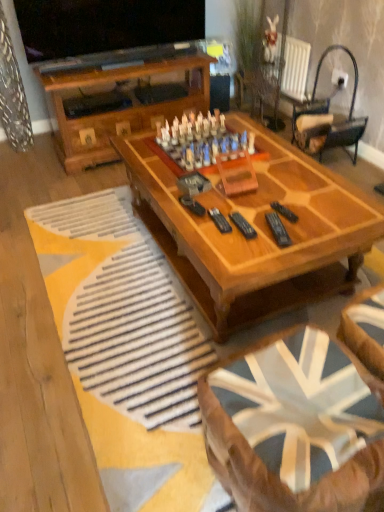
Question: From a real-world perspective, is black plastic remote at center, arranged as the second remote when viewed from the right, on top of wooden chess set at center?

Choices:
 (A) yes
 (B) no

Answer: (A)

Question: Is black plastic remote at center, arranged as the second remote when viewed from the right, at the right side of wooden chess set at center?

Choices:
 (A) no
 (B) yes

Answer: (B)

Question: Does black plastic remote at center, arranged as the second remote when viewed from the right, have a lesser height compared to wooden chess set at center?

Choices:
 (A) yes
 (B) no

Answer: (B)

Question: Are black plastic remote at center, arranged as the second remote when viewed from the right, and wooden chess set at center located far from each other?

Choices:
 (A) no
 (B) yes

Answer: (A)

Question: Would you say black plastic remote at center, arranged as the second remote when viewed from the right, is outside wooden chess set at center?

Choices:
 (A) no
 (B) yes

Answer: (B)

Question: Would you say wooden coffee table at center, the 1th coffee table from the top, is inside or outside black plastic remote at center, arranged as the second remote when viewed from the right?

Choices:
 (A) inside
 (B) outside

Answer: (B)

Question: From their relative heights in the image, would you say wooden coffee table at center, arranged as the 2th coffee table when ordered from the bottom, is taller or shorter than black plastic remote at center, which is the 2th remote in left-to-right order?

Choices:
 (A) tall
 (B) short

Answer: (A)

Question: Based on their sizes in the image, would you say wooden coffee table at center, arranged as the 2th coffee table when ordered from the bottom, is bigger or smaller than black plastic remote at center, arranged as the second remote when viewed from the right?

Choices:
 (A) small
 (B) big

Answer: (B)

Question: In the image, is wooden coffee table at center, arranged as the 2th coffee table when ordered from the bottom, on the left side or the right side of black plastic remote at center, which is the 2th remote in left-to-right order?

Choices:
 (A) right
 (B) left

Answer: (B)

Question: Relative to wooden coffee table at center, which is counted as the 1th coffee table, starting from the back, is black plastic remote at center, which is the 2th remote in left-to-right order, in front or behind?

Choices:
 (A) behind
 (B) front

Answer: (A)

Question: Which is correct: black plastic remote at center, which is the 2th remote in left-to-right order, is inside wooden coffee table at center, the 1th coffee table from the top, or outside of it?

Choices:
 (A) inside
 (B) outside

Answer: (B)

Question: Is black plastic remote at center, arranged as the second remote when viewed from the right, taller or shorter than wooden coffee table at center, which is counted as the 1th coffee table, starting from the back?

Choices:
 (A) short
 (B) tall

Answer: (A)

Question: In terms of width, does black plastic remote at center, which is the 2th remote in left-to-right order, look wider or thinner when compared to wooden coffee table at center, arranged as the 2th coffee table when ordered from the bottom?

Choices:
 (A) thin
 (B) wide

Answer: (A)

Question: From a real-world perspective, relative to black metal/wooden rocking chair at upper right, is black plastic remote at center, marked as the 1th remote in a left-to-right arrangement, vertically above or below?

Choices:
 (A) below
 (B) above

Answer: (B)

Question: In the image, is black plastic remote at center, marked as the 1th remote in a left-to-right arrangement, positioned in front of or behind black metal/wooden rocking chair at upper right?

Choices:
 (A) behind
 (B) front

Answer: (B)